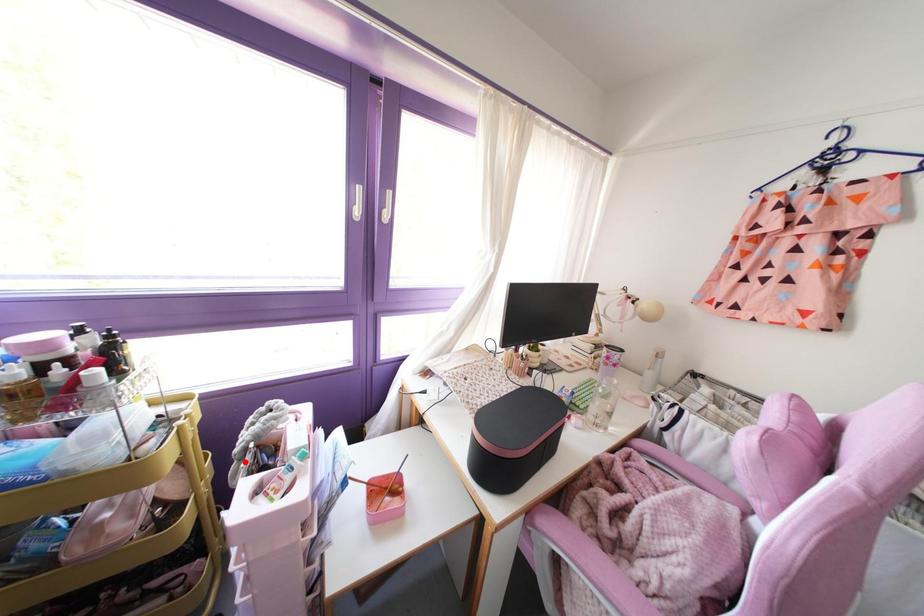
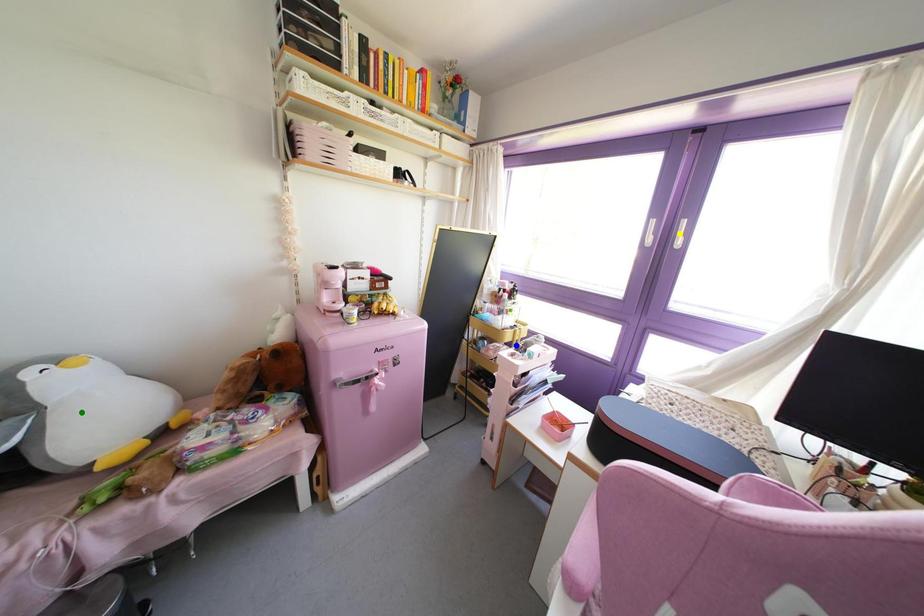
Question: I am providing you with two images of the same scene from different viewpoints. A red point is marked on the first image. You are given multiple points on the second image. Which mark in image 2 goes with the point in image 1?

Choices:
 (A) green point
 (B) blue point
 (C) yellow point

Answer: (B)